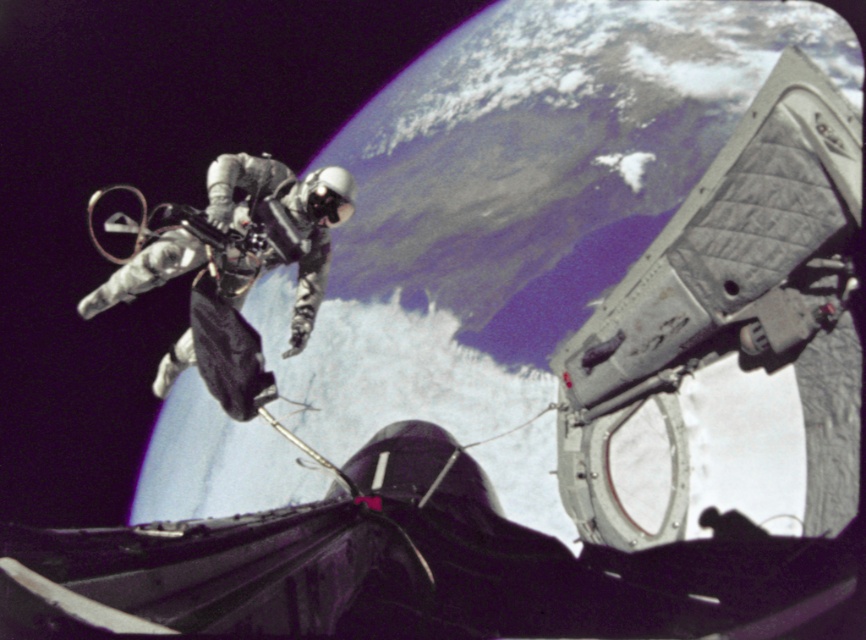
Consider the image. You are an astronaut preparing to retrieve an object located at point (808, 440) during a spacewalk. Your safety tether can extend up to 3 meters. Can you safely reach the object without detaching the tether?

The distance of point (808, 440) from the camera is 3.26 meters, which exceeds the 3 meter limit of the tether. Therefore, the astronaut cannot safely reach the object without detaching the tether.

You are an astronaut floating in space and need to secure a tool to the gray quilted fabric at upper right and the silver metallic spacesuit at center. Considering their widths, which object might be more challenging to attach the tool to?

The gray quilted fabric at upper right has a lesser width compared to the silver metallic spacesuit at center, so it might be more challenging to attach the tool to the gray quilted fabric at upper right due to its narrower surface area.

You are an astronaut conducting a spacewalk and need to retrieve an object floating near the gray quilted fabric at upper right. Your current position is 3 meters away from the camera. Can you reach it without moving your position?

The gray quilted fabric at upper right is 2.42 meters away from the camera. Since you are currently 3 meters away from the camera, you are farther than the object, so you cannot reach it without moving closer.